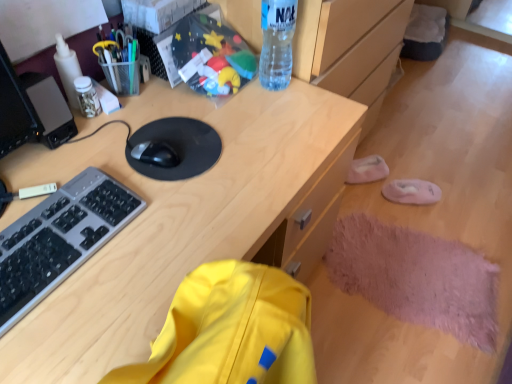
Where is `unoccupied space behind gray plastic keyboard at left`? The height and width of the screenshot is (384, 512). unoccupied space behind gray plastic keyboard at left is located at coordinates (86, 158).